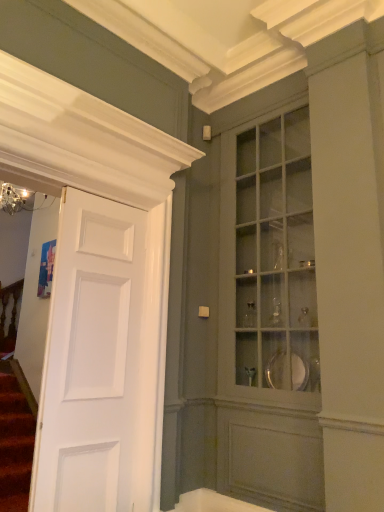
You are a GUI agent. You are given a task and a screenshot of the screen. Output one action in this format:
    pyautogui.click(x=<x>, y=<y>)
    Task: Click on the white glossy bathtub at lower center
    This screenshot has height=512, width=384.
    Given the screenshot: What is the action you would take?
    pyautogui.click(x=213, y=503)

What is the approximate width of matte glass cabinet at center?

The width of matte glass cabinet at center is 16.86 inches.

At what (x,y) coordinates should I click in order to perform the action: click on white glossy bathtub at lower center. Please return your answer as a coordinate pair (x, y). The height and width of the screenshot is (512, 384). Looking at the image, I should click on (213, 503).

Where is `cabinetry located above the white glossy bathtub at lower center (from a real-world perspective)`? The image size is (384, 512). cabinetry located above the white glossy bathtub at lower center (from a real-world perspective) is located at coordinates (268, 257).

From a real-world perspective, is white glossy bathtub at lower center physically located above or below matte glass cabinet at center?

white glossy bathtub at lower center is below matte glass cabinet at center.

Is the position of white glossy bathtub at lower center more distant than that of matte glass cabinet at center?

Yes, white glossy bathtub at lower center is further from the viewer.

Considering the points (214, 505) and (110, 229), which point is behind, point (214, 505) or point (110, 229)?

The point (110, 229) is behind.

How distant is white glossy bathtub at lower center from white matte door at left?

white glossy bathtub at lower center is 35.71 inches away from white matte door at left.

Would you say white glossy bathtub at lower center is outside white matte door at left?

Absolutely, white glossy bathtub at lower center is external to white matte door at left.

Would you say matte glass cabinet at center contains white matte door at left?

No.

Considering the positions of objects matte glass cabinet at center and white matte door at left in the image provided, who is more to the left, matte glass cabinet at center or white matte door at left?

From the viewer's perspective, white matte door at left appears more on the left side.

Consider the image. Is matte glass cabinet at center shorter than white matte door at left?

Incorrect, the height of matte glass cabinet at center does not fall short of that of white matte door at left.

Image resolution: width=384 pixels, height=512 pixels. Find the location of `bath below the matte glass cabinet at center (from a real-world perspective)`. bath below the matte glass cabinet at center (from a real-world perspective) is located at coordinates (213, 503).

From the image's perspective, is matte glass cabinet at center located above white glossy bathtub at lower center?

Yes, from the image's perspective, matte glass cabinet at center is on top of white glossy bathtub at lower center.

Which is less distant, (297, 312) or (208, 500)?

Point (297, 312) is farther from the camera than point (208, 500).

Is matte glass cabinet at center situated inside white glossy bathtub at lower center or outside?

matte glass cabinet at center is not enclosed by white glossy bathtub at lower center.

Could you tell me if white matte door at left is turned towards matte glass cabinet at center?

No, white matte door at left is not turned towards matte glass cabinet at center.

Is white matte door at left situated inside matte glass cabinet at center or outside?

white matte door at left is outside matte glass cabinet at center.

From a real-world perspective, who is located higher, white matte door at left or matte glass cabinet at center?

matte glass cabinet at center, from a real-world perspective.

In terms of width, does white matte door at left look wider or thinner when compared to white glossy bathtub at lower center?

Clearly, white matte door at left has more width compared to white glossy bathtub at lower center.

Is white matte door at left oriented towards white glossy bathtub at lower center?

No, white matte door at left is not oriented towards white glossy bathtub at lower center.

Is white matte door at left smaller than white glossy bathtub at lower center?

No.

Is white matte door at left positioned far away from white glossy bathtub at lower center?

No, there isn't a large distance between white matte door at left and white glossy bathtub at lower center.

Find the location of a particular element. cabinetry that is on the right side of white glossy bathtub at lower center is located at coordinates (268, 257).

Identify the location of door above the white glossy bathtub at lower center (from a real-world perspective). Image resolution: width=384 pixels, height=512 pixels. (98, 362).

Looking at the image, which one is located further to matte glass cabinet at center, white glossy bathtub at lower center or white matte door at left?

Based on the image, white glossy bathtub at lower center appears to be further to matte glass cabinet at center.

When comparing their distances from white glossy bathtub at lower center, does matte glass cabinet at center or white matte door at left seem further?

Based on the image, matte glass cabinet at center appears to be further to white glossy bathtub at lower center.

Based on their spatial positions, is white matte door at left or white glossy bathtub at lower center closer to matte glass cabinet at center?

white matte door at left is positioned closer to the anchor matte glass cabinet at center.

Based on their spatial positions, is white matte door at left or matte glass cabinet at center closer to white glossy bathtub at lower center?

white matte door at left.

When comparing their distances from white matte door at left, does matte glass cabinet at center or white glossy bathtub at lower center seem further?

matte glass cabinet at center is positioned further to the anchor white matte door at left.

From the image, which object appears to be nearer to white matte door at left, white glossy bathtub at lower center or matte glass cabinet at center?

The object closer to white matte door at left is white glossy bathtub at lower center.

Locate an element on the screen. The image size is (384, 512). door between matte glass cabinet at center and white glossy bathtub at lower center from top to bottom is located at coordinates (98, 362).